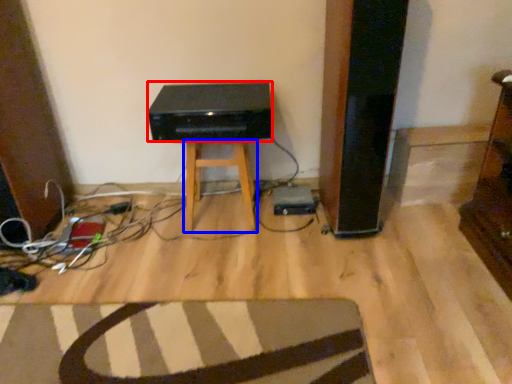
Question: Which object is further to the camera taking this photo, stereo (highlighted by a red box) or stool (highlighted by a blue box)?

Choices:
 (A) stereo
 (B) stool

Answer: (B)